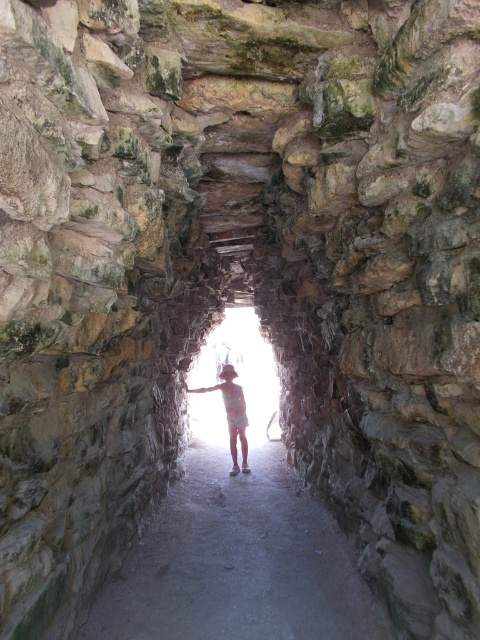
Is smooth concrete path at center shorter than multicolored fabric at center?

Yes, smooth concrete path at center is shorter than multicolored fabric at center.

Is smooth concrete path at center bigger than multicolored fabric at center?

Indeed, smooth concrete path at center has a larger size compared to multicolored fabric at center.

Describe the element at coordinates (238, 561) in the screenshot. I see `smooth concrete path at center` at that location.

Identify the location of smooth concrete path at center. (238, 561).